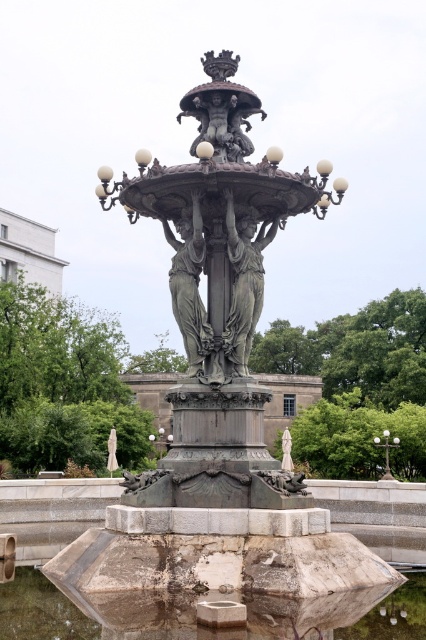
Question: Can you confirm if polished bronze statue at center is positioned below green metal/bronze streetlight at center?

Choices:
 (A) no
 (B) yes

Answer: (A)

Question: Among these objects, which one is farthest from the camera?

Choices:
 (A) green metal/bronze streetlight at center
 (B) polished bronze statue at center
 (C) matte bronze lamp post at center
 (D) white marble statue at center

Answer: (C)

Question: Is translucent stone water at lower center positioned in front of bronze statue at center?

Choices:
 (A) yes
 (B) no

Answer: (A)

Question: Does translucent stone water at lower center come behind bronze statue at center?

Choices:
 (A) no
 (B) yes

Answer: (A)

Question: Which object is closer to the camera taking this photo?

Choices:
 (A) green metal/bronze streetlight at center
 (B) polished bronze statue at center
 (C) bronze statue at center

Answer: (C)

Question: Which point appears farthest from the camera in this image?

Choices:
 (A) (201, 305)
 (B) (385, 624)
 (C) (158, 456)

Answer: (C)